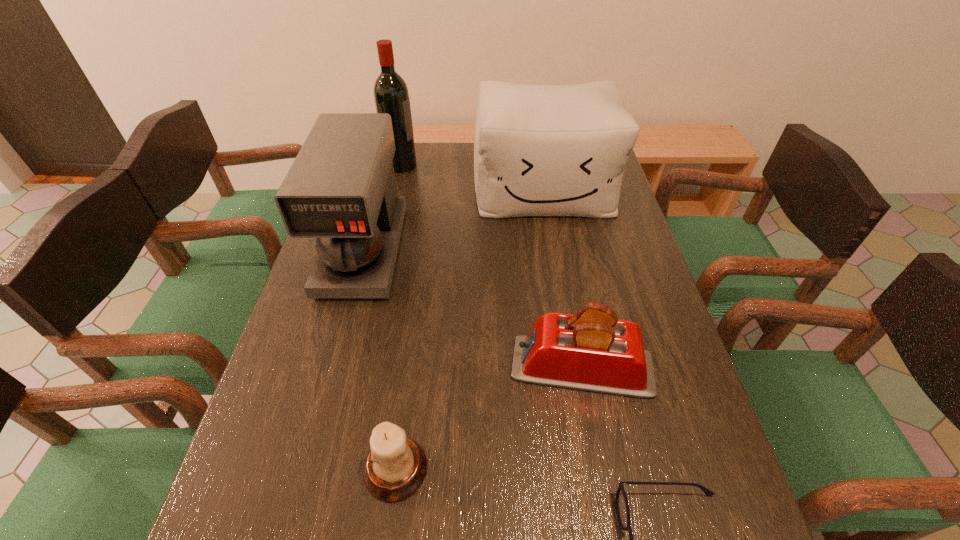
Image resolution: width=960 pixels, height=540 pixels. What are the coordinates of `vacant area at the far edge of the desktop` in the screenshot? It's located at (474, 145).

Find the location of a particular element. vacant point at the left edge is located at coordinates 295,441.

The image size is (960, 540). In order to click on blank space at the right edge of the desktop in this screenshot , I will do `click(651, 491)`.

Image resolution: width=960 pixels, height=540 pixels. I want to click on unoccupied area between the coffee maker and the candle holder, so click(x=380, y=360).

Locate an element on the screen. vacant space that is in between the coffee maker and the cushion is located at coordinates (454, 220).

Image resolution: width=960 pixels, height=540 pixels. In order to click on empty location between the coffee maker and the toaster in this screenshot , I will do `click(472, 308)`.

This screenshot has height=540, width=960. I want to click on free space between the third shortest object and the coffee maker, so click(472, 308).

The height and width of the screenshot is (540, 960). I want to click on free spot between the wine bottle and the fourth object from right to left, so click(x=398, y=317).

At what (x,y) coordinates should I click in order to perform the action: click on blank region between the cushion and the wine bottle. Please return your answer as a coordinate pair (x, y). Image resolution: width=960 pixels, height=540 pixels. Looking at the image, I should click on (472, 177).

Where is `vacant space that's between the candle holder and the tallest object`? The image size is (960, 540). vacant space that's between the candle holder and the tallest object is located at coordinates (398, 317).